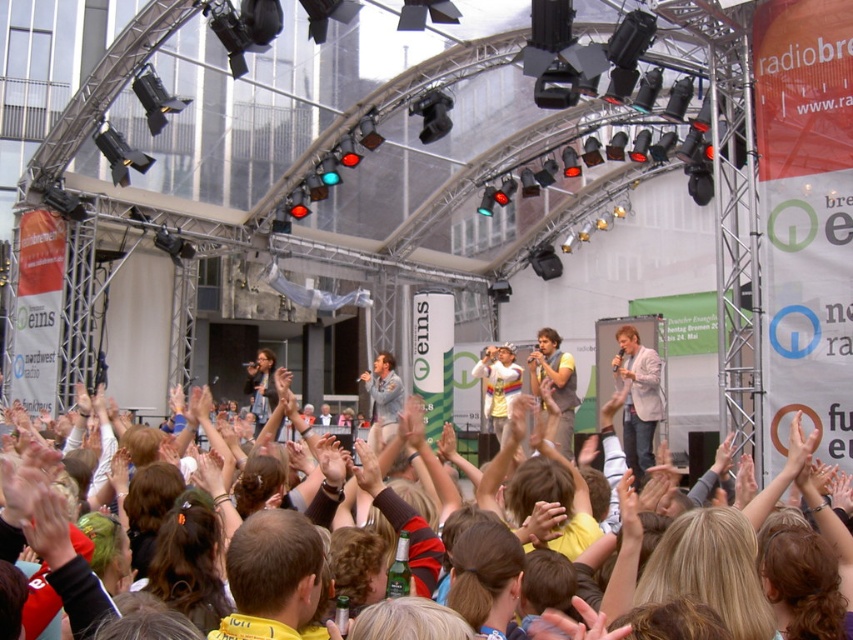
Question: Is light brown blazer at center smaller than yellow fabric vest at center?

Choices:
 (A) no
 (B) yes

Answer: (B)

Question: Is multicolored fabric crowd at center smaller than yellow fabric vest at center?

Choices:
 (A) no
 (B) yes

Answer: (A)

Question: Which object is farther from the camera taking this photo?

Choices:
 (A) multicolored fabric crowd at center
 (B) yellow fabric vest at center
 (C) light brown blazer at center

Answer: (C)

Question: Which point is farther to the camera?

Choices:
 (A) light brown blazer at center
 (B) multicolored fabric crowd at center
 (C) yellow fabric vest at center

Answer: (A)

Question: Estimate the real-world distances between objects in this image. Which object is farther from the light brown blazer at center?

Choices:
 (A) yellow fabric vest at center
 (B) multicolored fabric crowd at center

Answer: (B)

Question: Does multicolored fabric crowd at center appear on the left side of yellow fabric vest at center?

Choices:
 (A) yes
 (B) no

Answer: (A)